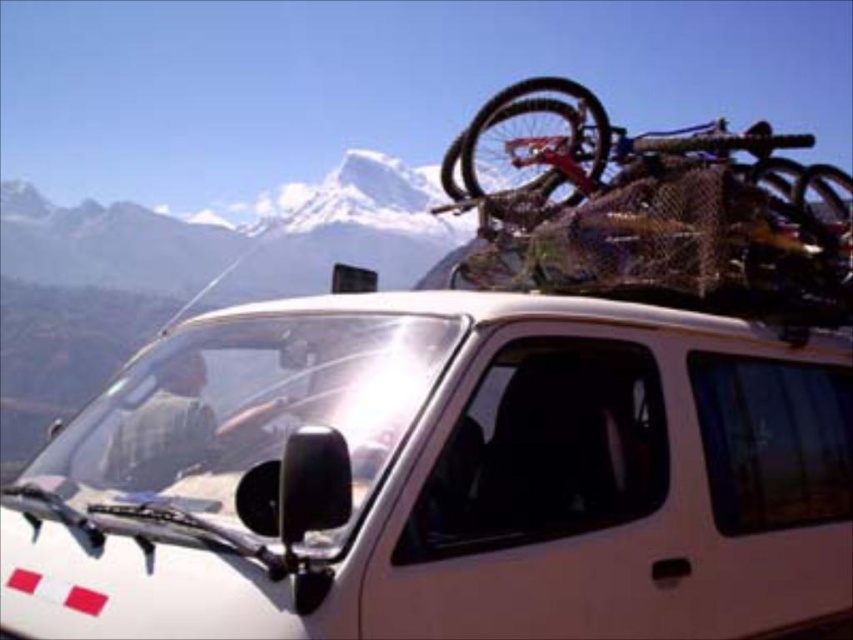
You are standing at the edge of a mountain trail and see the white matte van at center parked ahead. If you want to walk to the van, how many steps of 3 feet each would you need to take to reach it?

The distance between you and the white matte van at center is 31.50 feet. Since each step is 3 feet, you would need to take 11 steps because 31.50 divided by 3 equals 10.5, so rounding up to the nearest whole number gives 11 steps.